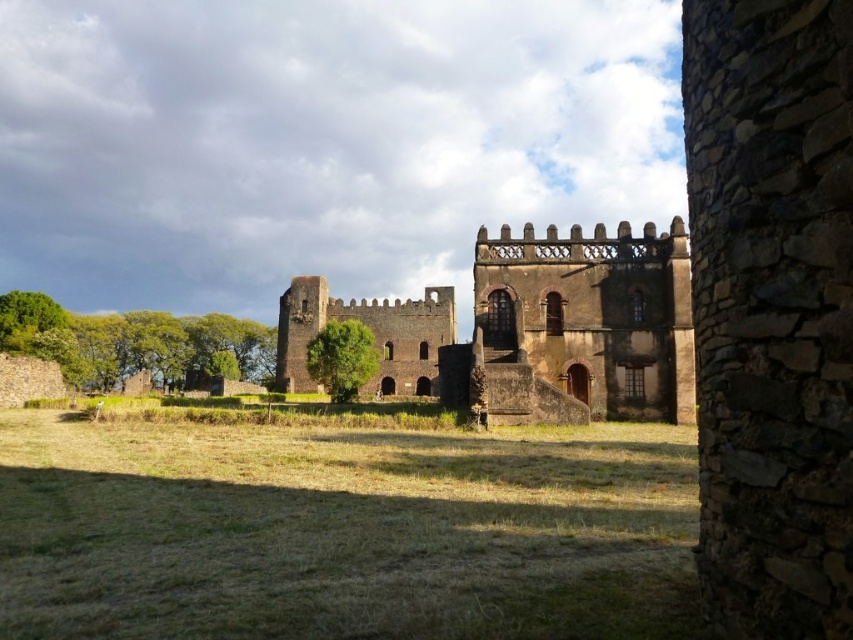
You are standing in the field near the edge of the grassy area. You see the green grass at center and the brown stone castle at center. Which object is closer to your right side?

The brown stone castle at center is to the right of the green grass at center, so the brown stone castle at center is closer to your right side.

You are a visitor standing in the field looking at the green grass at center and the brown stone castle at center. Which object takes up more space in the image?

The brown stone castle at center takes up more space in the image than the green grass at center because the green grass at center is smaller than the brown stone castle at center.